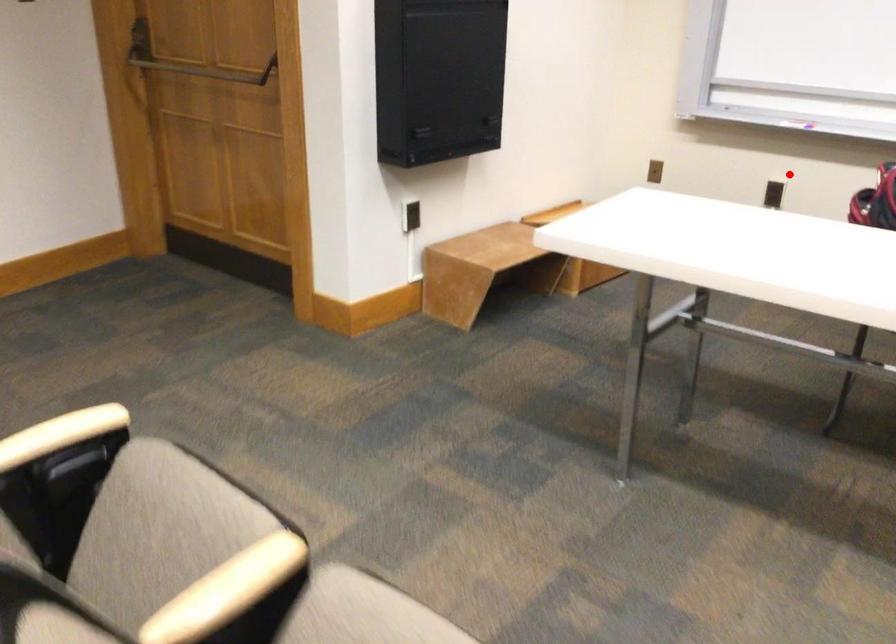
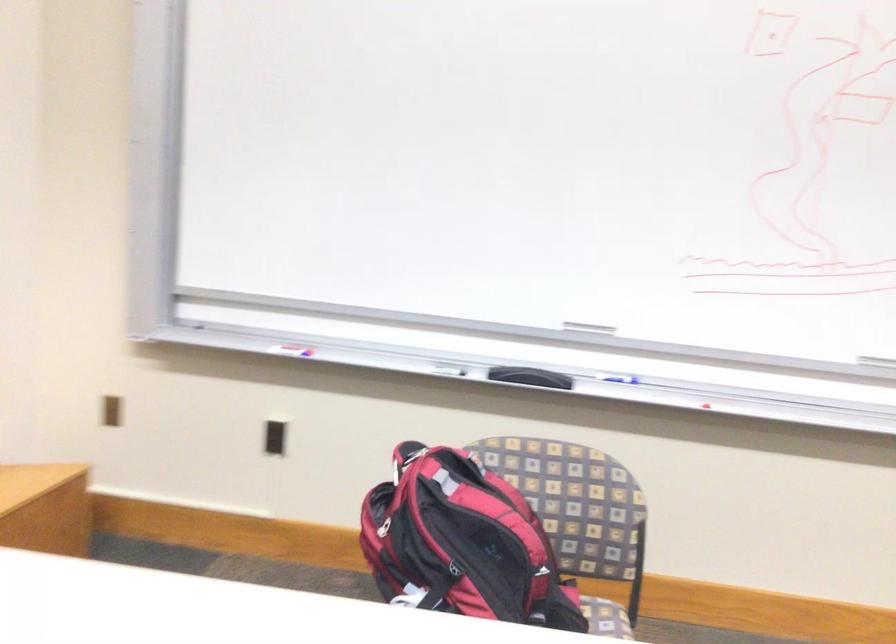
Question: I am providing you with two images of the same scene from different viewpoints. In image1, a red point is highlighted. Considering the same 3D point in image2, which of the following is correct?

Choices:
 (A) It is closer
 (B) It is farther

Answer: (A)